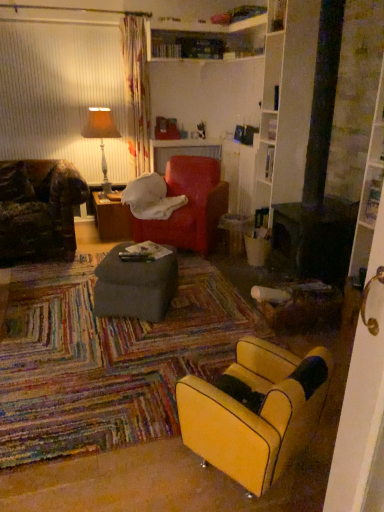
Locate an element on the screen. free point in front of matte gray ottoman at center, which appears as the first table when viewed from the right is located at coordinates (136, 339).